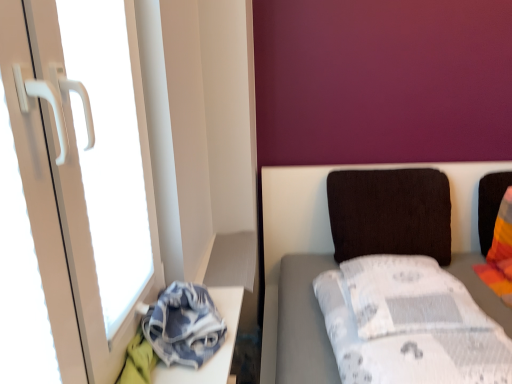
Question: Considering the relative sizes of dark brown fabric pillow at center-right and denim fabric at lower left in the image provided, is dark brown fabric pillow at center-right thinner than denim fabric at lower left?

Choices:
 (A) yes
 (B) no

Answer: (A)

Question: From the image's perspective, is dark brown fabric pillow at center-right above denim fabric at lower left?

Choices:
 (A) yes
 (B) no

Answer: (A)

Question: Is dark brown fabric pillow at center-right facing towards denim fabric at lower left?

Choices:
 (A) no
 (B) yes

Answer: (A)

Question: Considering the relative sizes of dark brown fabric pillow at center-right and denim fabric at lower left in the image provided, is dark brown fabric pillow at center-right taller than denim fabric at lower left?

Choices:
 (A) no
 (B) yes

Answer: (B)

Question: From the image's perspective, is dark brown fabric pillow at center-right beneath denim fabric at lower left?

Choices:
 (A) no
 (B) yes

Answer: (A)

Question: Is dark brown fabric pillow at center-right outside of denim fabric at lower left?

Choices:
 (A) no
 (B) yes

Answer: (B)

Question: Is denim fabric at lower left smaller than dark brown fabric pillow at center-right?

Choices:
 (A) no
 (B) yes

Answer: (B)

Question: Is denim fabric at lower left to the right of dark brown fabric pillow at center-right from the viewer's perspective?

Choices:
 (A) yes
 (B) no

Answer: (B)

Question: From the image's perspective, would you say denim fabric at lower left is positioned over dark brown fabric pillow at center-right?

Choices:
 (A) yes
 (B) no

Answer: (B)

Question: Is denim fabric at lower left positioned in front of dark brown fabric pillow at center-right?

Choices:
 (A) yes
 (B) no

Answer: (A)

Question: Does denim fabric at lower left have a lesser width compared to dark brown fabric pillow at center-right?

Choices:
 (A) no
 (B) yes

Answer: (A)

Question: Considering the relative sizes of denim fabric at lower left and dark brown fabric pillow at center-right in the image provided, is denim fabric at lower left shorter than dark brown fabric pillow at center-right?

Choices:
 (A) no
 (B) yes

Answer: (B)

Question: Is denim fabric at lower left thinner than white plastic screen door at left?

Choices:
 (A) no
 (B) yes

Answer: (A)